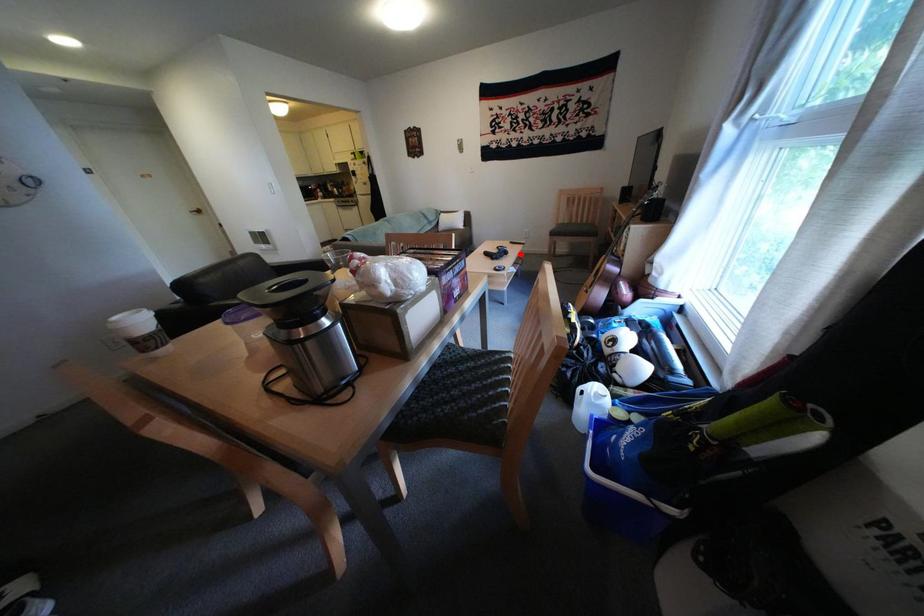
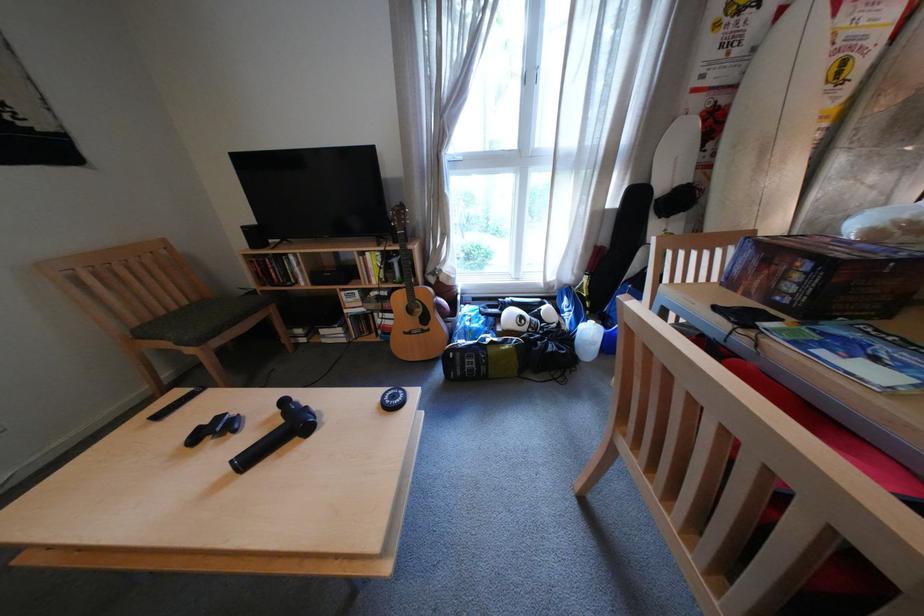
In the second image, find the point that corresponds to the highlighted location in the first image.

(298, 403)